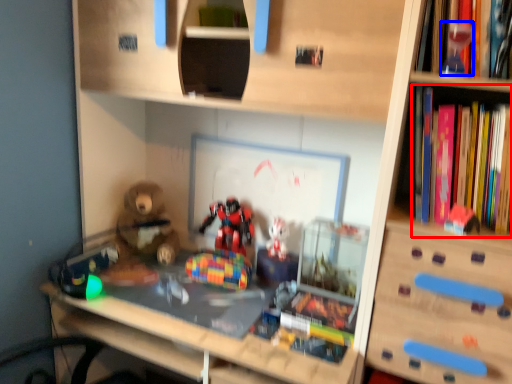
Question: Which object is closer to the camera taking this photo, book (highlighted by a red box) or toy (highlighted by a blue box)?

Choices:
 (A) book
 (B) toy

Answer: (A)